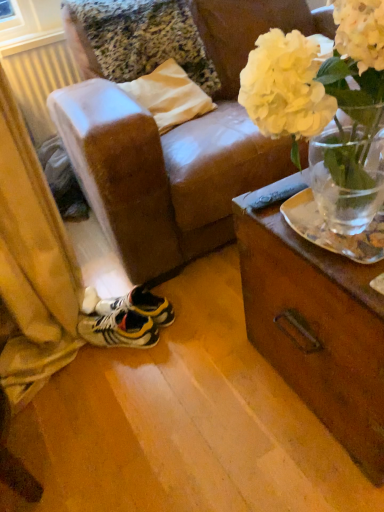
Question: Is white plastic radiator at left not close to yellow and black synthetic sneakers at lower left?

Choices:
 (A) yes
 (B) no

Answer: (A)

Question: Is white plastic radiator at left smaller than yellow and black synthetic sneakers at lower left?

Choices:
 (A) no
 (B) yes

Answer: (A)

Question: From the image's perspective, is white plastic radiator at left below yellow and black synthetic sneakers at lower left?

Choices:
 (A) yes
 (B) no

Answer: (B)

Question: From the image's perspective, is white plastic radiator at left on yellow and black synthetic sneakers at lower left?

Choices:
 (A) yes
 (B) no

Answer: (A)

Question: Is white plastic radiator at left next to yellow and black synthetic sneakers at lower left?

Choices:
 (A) yes
 (B) no

Answer: (B)

Question: Is white plastic radiator at left thinner than yellow and black synthetic sneakers at lower left?

Choices:
 (A) no
 (B) yes

Answer: (B)

Question: From the image's perspective, is yellow and black synthetic sneakers at lower left under white matte vase at upper right?

Choices:
 (A) no
 (B) yes

Answer: (B)

Question: Considering the relative positions of yellow and black synthetic sneakers at lower left and white matte vase at upper right in the image provided, is yellow and black synthetic sneakers at lower left to the left of white matte vase at upper right from the viewer's perspective?

Choices:
 (A) yes
 (B) no

Answer: (A)

Question: Considering the relative sizes of yellow and black synthetic sneakers at lower left and white matte vase at upper right in the image provided, is yellow and black synthetic sneakers at lower left bigger than white matte vase at upper right?

Choices:
 (A) no
 (B) yes

Answer: (A)

Question: Can you confirm if yellow and black synthetic sneakers at lower left is smaller than white matte vase at upper right?

Choices:
 (A) no
 (B) yes

Answer: (B)

Question: From a real-world perspective, is yellow and black synthetic sneakers at lower left positioned over white matte vase at upper right based on gravity?

Choices:
 (A) no
 (B) yes

Answer: (A)

Question: Is yellow and black synthetic sneakers at lower left taller than white matte vase at upper right?

Choices:
 (A) yes
 (B) no

Answer: (B)

Question: Is white matte vase at upper right facing towards yellow and black synthetic sneakers at lower left?

Choices:
 (A) no
 (B) yes

Answer: (A)